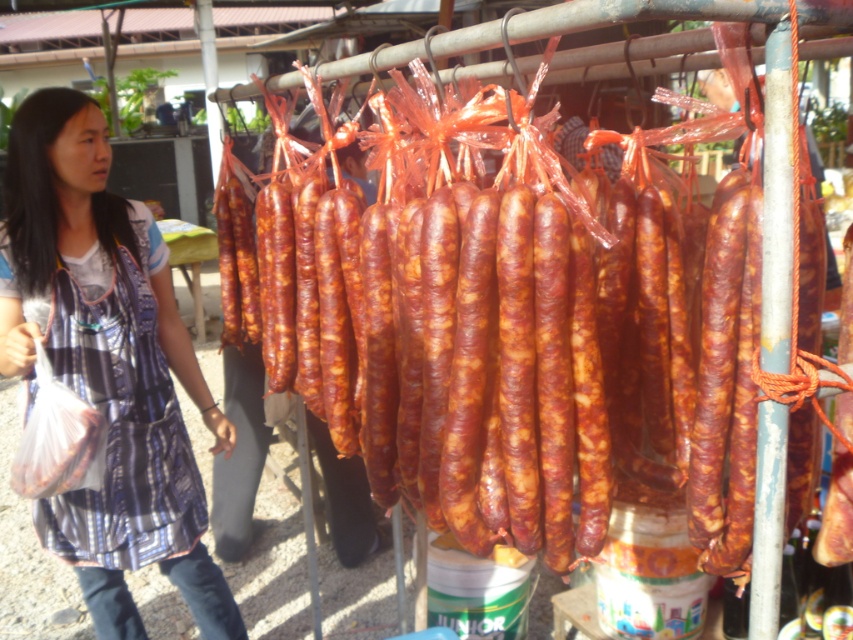
This screenshot has height=640, width=853. What do you see at coordinates (421, 312) in the screenshot? I see `brown glossy sausages at center` at bounding box center [421, 312].

Between point (408, 132) and point (114, 550), which one is positioned behind?

The point (114, 550) is behind.

Who is more distant from viewer, (579, 456) or (86, 570)?

The point (86, 570) is behind.

In order to click on brown glossy sausages at center in this screenshot , I will do `click(421, 312)`.